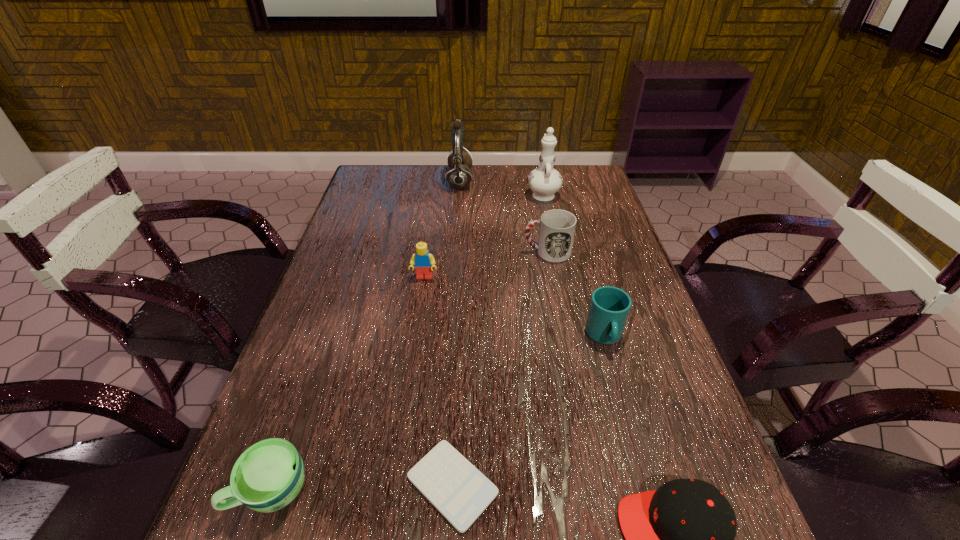
The width and height of the screenshot is (960, 540). I want to click on free spot that satisfies the following two spatial constraints: 1. at the spout of the chinaware; 2. on the ear pads of the earphone, so click(x=540, y=181).

What are the coordinates of `free spot that satisfies the following two spatial constraints: 1. on the ear pads of the earphone; 2. on the front-facing side of the Lego` in the screenshot? It's located at click(453, 278).

This screenshot has height=540, width=960. Identify the location of vacant region that satisfies the following two spatial constraints: 1. on the ear pads of the earphone; 2. on the side of the third farthest object where the handle is located. (455, 252).